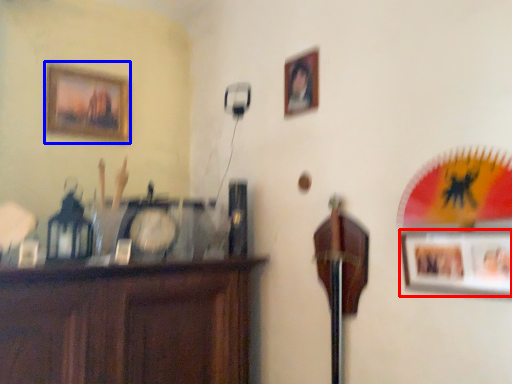
Question: Which point is closer to the camera, picture frame (highlighted by a red box) or picture frame (highlighted by a blue box)?

Choices:
 (A) picture frame
 (B) picture frame

Answer: (A)